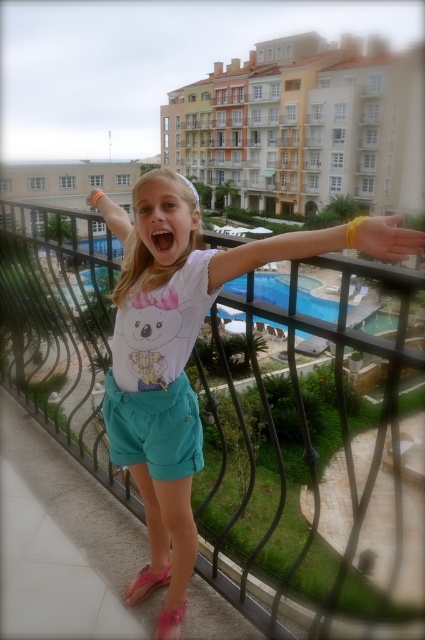
In the scene shown: Does teal fabric shorts at center have a lesser height compared to pink fabric sandal at lower center?

No.

Does point (167, 468) come behind point (166, 577)?

That is False.

Is point (158, 460) positioned after point (136, 577)?

No, (158, 460) is closer to viewer.

Locate an element on the screen. The image size is (425, 640). teal fabric shorts at center is located at coordinates (155, 428).

Between white cotton shirt at center and teal fabric shorts at center, which one is positioned lower?

teal fabric shorts at center

Who is taller, white cotton shirt at center or teal fabric shorts at center?

Standing taller between the two is white cotton shirt at center.

Does point (240, 248) come closer to viewer compared to point (198, 444)?

Yes, it is in front of point (198, 444).

What are the coordinates of `white cotton shirt at center` in the screenshot? It's located at (186, 340).

Between blue glass pool at center and pink satin sandal at lower center, which one appears on the left side from the viewer's perspective?

pink satin sandal at lower center is more to the left.

Where is `blue glass pool at center`? blue glass pool at center is located at coordinates (314, 301).